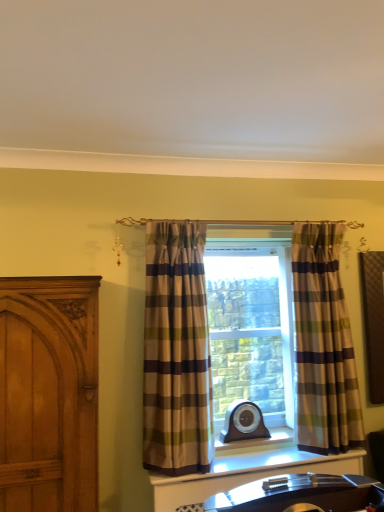
Locate an element on the screen. The image size is (384, 512). free space underneath plaid fabric curtain at center, which ranks as the first curtain in right-to-left order (from a real-world perspective) is located at coordinates (328, 453).